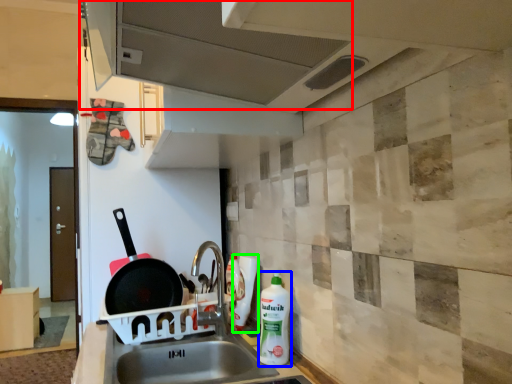
Question: Based on their relative distances, which object is farther from exhaust hood (highlighted by a red box)? Choose from cleaning product (highlighted by a blue box) and bottle (highlighted by a green box).

Choices:
 (A) cleaning product
 (B) bottle

Answer: (B)